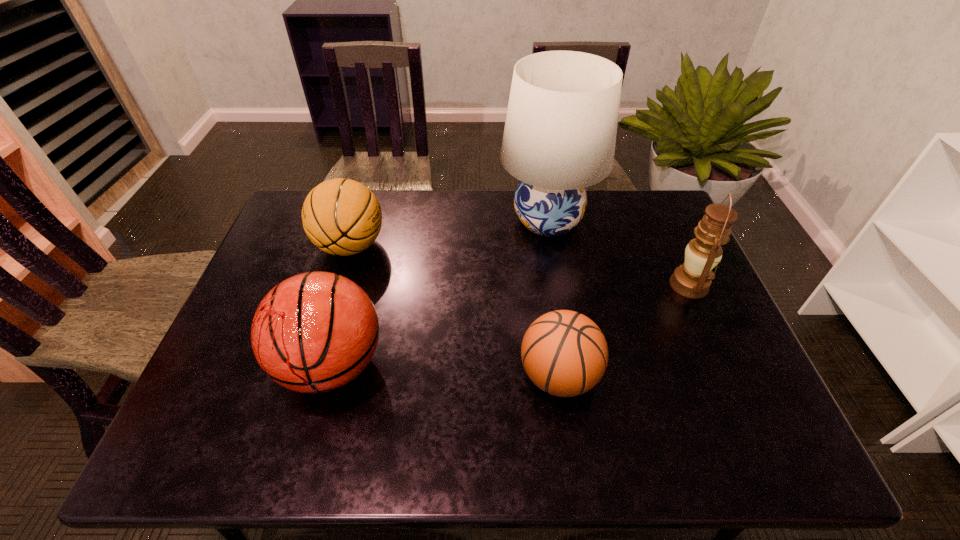
Image resolution: width=960 pixels, height=540 pixels. In order to click on free space located 0.200m on the back of the rightmost object in this screenshot , I will do `click(661, 223)`.

This screenshot has height=540, width=960. Identify the location of free space located on the side with spill of the tallest basketball. (307, 457).

Image resolution: width=960 pixels, height=540 pixels. Identify the location of vacant space located on the surface of the farthest basketball near the brand logo. (482, 246).

The width and height of the screenshot is (960, 540). In order to click on free space located on the front of the shortest object in this screenshot , I will do `click(570, 458)`.

Locate an element on the screen. lampshade located in the far edge section of the desktop is located at coordinates (560, 132).

The height and width of the screenshot is (540, 960). In order to click on basketball situated at the far edge in this screenshot , I will do `click(342, 217)`.

This screenshot has width=960, height=540. I want to click on object present at the right edge, so [x=692, y=279].

At what (x,y) coordinates should I click in order to perform the action: click on object at the far left corner. Please return your answer as a coordinate pair (x, y). This screenshot has height=540, width=960. Looking at the image, I should click on (342, 217).

You are a GUI agent. You are given a task and a screenshot of the screen. Output one action in this format:
    pyautogui.click(x=<x>, y=<y>)
    Task: Click on the free space at the far edge of the desktop
    This screenshot has height=540, width=960.
    Given the screenshot: What is the action you would take?
    pyautogui.click(x=443, y=208)

In the image, there is a desktop. Where is `vacant space at the near edge`? vacant space at the near edge is located at coordinates (378, 430).